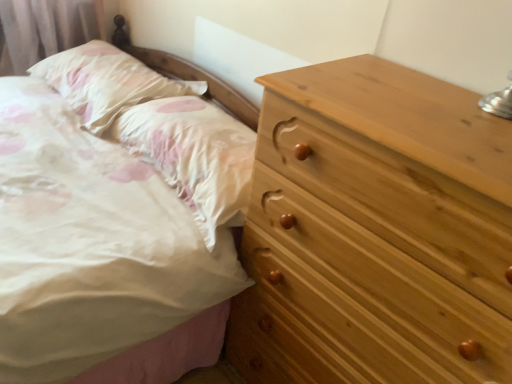
Question: Can you confirm if white satin pillow at upper left, which is counted as the 2th pillow, starting from the left, is thinner than white satin pillow at upper left, the 1th pillow viewed from the left?

Choices:
 (A) yes
 (B) no

Answer: (B)

Question: Is white satin pillow at upper left, which appears as the 1th pillow when viewed from the right, to the left of white satin pillow at upper left, the 1th pillow viewed from the left, from the viewer's perspective?

Choices:
 (A) no
 (B) yes

Answer: (A)

Question: From the image's perspective, does white satin pillow at upper left, which is counted as the 2th pillow, starting from the left, appear lower than white satin pillow at upper left, the 1th pillow viewed from the left?

Choices:
 (A) yes
 (B) no

Answer: (A)

Question: From a real-world perspective, is white satin pillow at upper left, which appears as the 1th pillow when viewed from the right, located higher than white satin pillow at upper left, acting as the 2th pillow starting from the right?

Choices:
 (A) no
 (B) yes

Answer: (A)

Question: From a real-world perspective, is white satin pillow at upper left, which is counted as the 2th pillow, starting from the left, under white satin pillow at upper left, the 1th pillow viewed from the left?

Choices:
 (A) yes
 (B) no

Answer: (A)

Question: Is there a large distance between white satin pillow at upper left, which is counted as the 2th pillow, starting from the left, and white satin pillow at upper left, the 1th pillow viewed from the left?

Choices:
 (A) no
 (B) yes

Answer: (A)

Question: From a real-world perspective, is natural wood chest of drawers at right under white satin pillow at upper left, which appears as the 1th pillow when viewed from the right?

Choices:
 (A) no
 (B) yes

Answer: (B)

Question: Is natural wood chest of drawers at right positioned before white satin pillow at upper left, which appears as the 1th pillow when viewed from the right?

Choices:
 (A) yes
 (B) no

Answer: (A)

Question: Could you tell me if natural wood chest of drawers at right is turned towards white satin pillow at upper left, which is counted as the 2th pillow, starting from the left?

Choices:
 (A) yes
 (B) no

Answer: (B)

Question: Can you see natural wood chest of drawers at right touching white satin pillow at upper left, which is counted as the 2th pillow, starting from the left?

Choices:
 (A) yes
 (B) no

Answer: (B)

Question: Considering the relative positions of natural wood chest of drawers at right and white satin pillow at upper left, which is counted as the 2th pillow, starting from the left, in the image provided, is natural wood chest of drawers at right to the left of white satin pillow at upper left, which is counted as the 2th pillow, starting from the left, from the viewer's perspective?

Choices:
 (A) yes
 (B) no

Answer: (B)

Question: Is natural wood chest of drawers at right smaller than white satin pillow at upper left, which is counted as the 2th pillow, starting from the left?

Choices:
 (A) yes
 (B) no

Answer: (B)

Question: Is the position of white satin pillow at upper left, the 1th pillow viewed from the left, more distant than that of white satin pillow at upper left, which is counted as the 2th pillow, starting from the left?

Choices:
 (A) no
 (B) yes

Answer: (B)